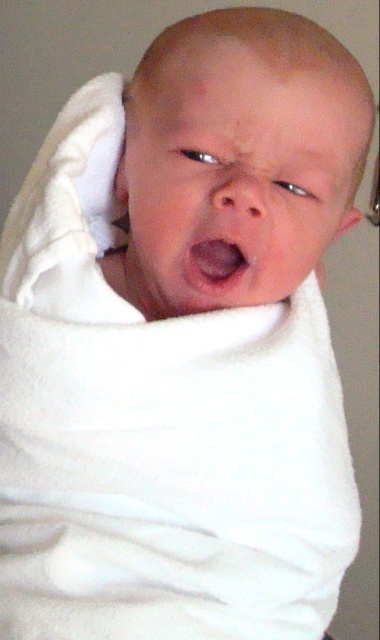
Question: Can you confirm if white soft ear at upper left is bigger than pink soft ear at upper right?

Choices:
 (A) no
 (B) yes

Answer: (A)

Question: Among these objects, which one is nearest to the camera?

Choices:
 (A) pink soft ear at upper right
 (B) white soft ear at upper left
 (C) pink smooth flesh at center

Answer: (C)

Question: Is white soft ear at upper left to the right of pink soft ear at upper right from the viewer's perspective?

Choices:
 (A) yes
 (B) no

Answer: (B)

Question: Does pink smooth flesh at center lie in front of white soft ear at upper left?

Choices:
 (A) no
 (B) yes

Answer: (B)

Question: Which object is the closest to the pink smooth flesh at center?

Choices:
 (A) pink soft ear at upper right
 (B) white soft ear at upper left

Answer: (A)

Question: Among these points, which one is nearest to the camera?

Choices:
 (A) (340, 216)
 (B) (228, 282)

Answer: (B)